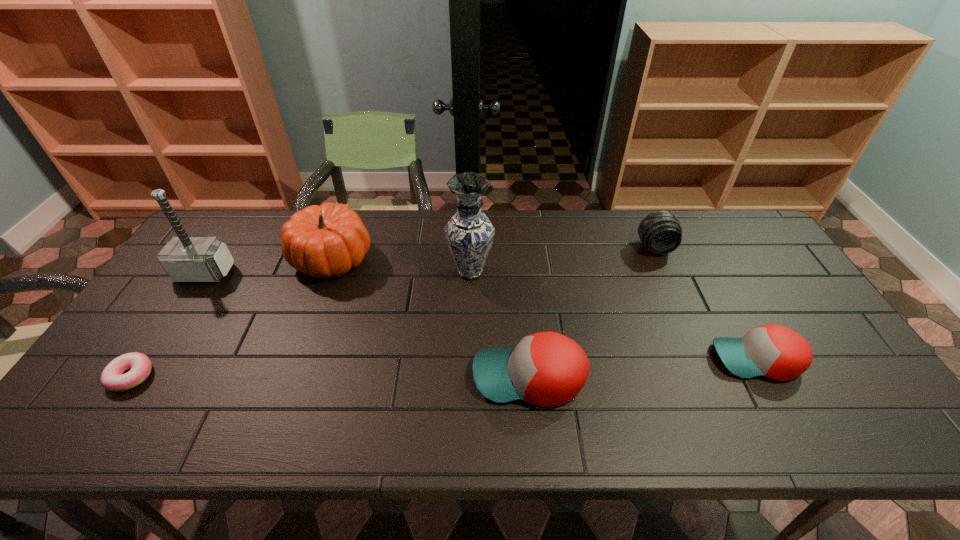
This screenshot has height=540, width=960. In order to click on unoccupied area between the hammer and the shorter baseball cap in this screenshot , I will do `click(481, 316)`.

Where is `free space between the fifth shortest object and the telephoto lens`? Image resolution: width=960 pixels, height=540 pixels. free space between the fifth shortest object and the telephoto lens is located at coordinates (493, 253).

Locate an element on the screen. The height and width of the screenshot is (540, 960). free spot between the third tallest object and the telephoto lens is located at coordinates (493, 253).

Locate which object ranks fourth in proximity to the vase. Please provide its 2D coordinates. Your answer should be formatted as a tuple, i.e. [(x, y)], where the tuple contains the x and y coordinates of a point satisfying the conditions above.

[(773, 351)]

Select which object appears as the sixth closest to the telephoto lens. Please provide its 2D coordinates. Your answer should be formatted as a tuple, i.e. [(x, y)], where the tuple contains the x and y coordinates of a point satisfying the conditions above.

[(112, 378)]

Locate an element on the screen. The height and width of the screenshot is (540, 960). free location that satisfies the following two spatial constraints: 1. on the front side of the vase; 2. on the left side of the third tallest object is located at coordinates [x=327, y=272].

Locate an element on the screen. Image resolution: width=960 pixels, height=540 pixels. free space in the image that satisfies the following two spatial constraints: 1. at the front element of the telephoto lens; 2. at the brim of the taller baseball cap is located at coordinates (712, 377).